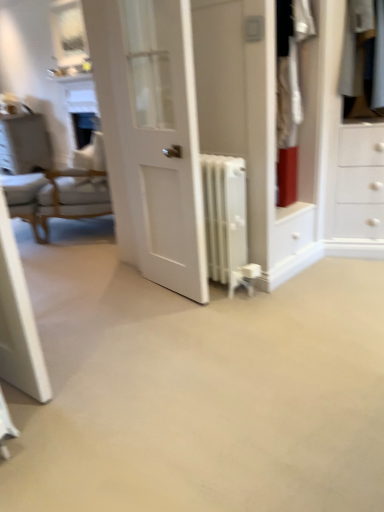
Question: Is light brown wooden armchair at left behind white glossy vanity at upper left?

Choices:
 (A) yes
 (B) no

Answer: (B)

Question: From a real-world perspective, is light brown wooden armchair at left on top of white glossy vanity at upper left?

Choices:
 (A) yes
 (B) no

Answer: (B)

Question: Would you say light brown wooden armchair at left is a long distance from white glossy vanity at upper left?

Choices:
 (A) no
 (B) yes

Answer: (B)

Question: Can you confirm if light brown wooden armchair at left is positioned to the left of white glossy vanity at upper left?

Choices:
 (A) no
 (B) yes

Answer: (A)

Question: Does light brown wooden armchair at left appear on the right side of white glossy vanity at upper left?

Choices:
 (A) no
 (B) yes

Answer: (B)

Question: From a real-world perspective, is light brown wooden armchair at left located beneath white glossy vanity at upper left?

Choices:
 (A) no
 (B) yes

Answer: (B)

Question: From a real-world perspective, is white glossy door at center under white fabric chair at left?

Choices:
 (A) yes
 (B) no

Answer: (B)

Question: Can you confirm if white glossy door at center is shorter than white fabric chair at left?

Choices:
 (A) no
 (B) yes

Answer: (A)

Question: Are white glossy door at center and white fabric chair at left far apart?

Choices:
 (A) no
 (B) yes

Answer: (B)

Question: Is white glossy door at center to the right of white fabric chair at left from the viewer's perspective?

Choices:
 (A) yes
 (B) no

Answer: (A)

Question: Does white glossy door at center have a greater height compared to white fabric chair at left?

Choices:
 (A) no
 (B) yes

Answer: (B)

Question: Can you confirm if white glossy door at center is bigger than white fabric chair at left?

Choices:
 (A) yes
 (B) no

Answer: (B)

Question: Is white glossy vanity at upper left taller than white glossy door at center?

Choices:
 (A) yes
 (B) no

Answer: (B)